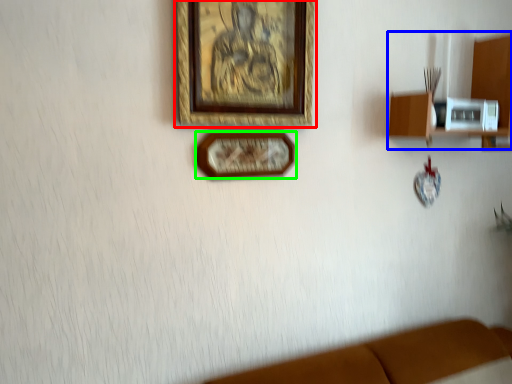
Question: Based on their relative distances, which object is nearer to picture frame (highlighted by a red box)? Choose from shelf (highlighted by a blue box) and picture frame (highlighted by a green box).

Choices:
 (A) shelf
 (B) picture frame

Answer: (B)